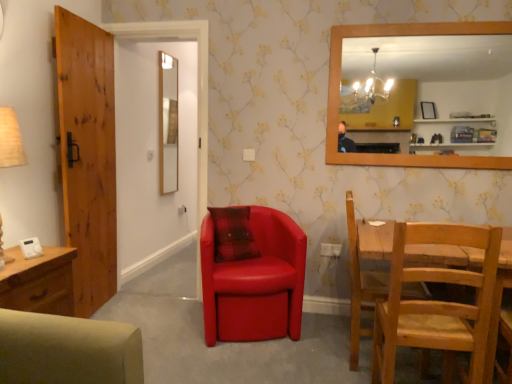
Where is `vacant area to the right of wooden door at left`? This screenshot has width=512, height=384. vacant area to the right of wooden door at left is located at coordinates (146, 305).